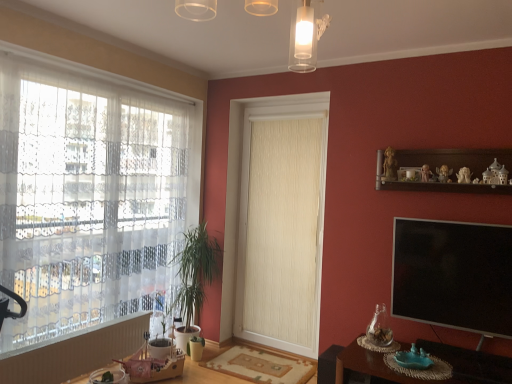
Question: From the image's perspective, is white textured radiator at lower left on top of green leafy plant at left?

Choices:
 (A) no
 (B) yes

Answer: (A)

Question: Does white textured radiator at lower left have a smaller size compared to green leafy plant at left?

Choices:
 (A) no
 (B) yes

Answer: (B)

Question: Is white textured radiator at lower left to the left of green leafy plant at left from the viewer's perspective?

Choices:
 (A) yes
 (B) no

Answer: (A)

Question: Is white textured radiator at lower left positioned in front of green leafy plant at left?

Choices:
 (A) no
 (B) yes

Answer: (B)

Question: Is white textured radiator at lower left further to camera compared to green leafy plant at left?

Choices:
 (A) yes
 (B) no

Answer: (B)

Question: Is the surface of white textured radiator at lower left in direct contact with green leafy plant at left?

Choices:
 (A) yes
 (B) no

Answer: (B)

Question: Can you confirm if translucent glass light fixture at upper center is smaller than beige textured curtain at center?

Choices:
 (A) no
 (B) yes

Answer: (B)

Question: Is translucent glass light fixture at upper center at the left side of beige textured curtain at center?

Choices:
 (A) no
 (B) yes

Answer: (B)

Question: Does translucent glass light fixture at upper center lie in front of beige textured curtain at center?

Choices:
 (A) yes
 (B) no

Answer: (A)

Question: Does translucent glass light fixture at upper center have a lesser width compared to beige textured curtain at center?

Choices:
 (A) no
 (B) yes

Answer: (A)

Question: Is translucent glass light fixture at upper center outside of beige textured curtain at center?

Choices:
 (A) yes
 (B) no

Answer: (A)

Question: From the image's perspective, is translucent glass light fixture at upper center under beige textured curtain at center?

Choices:
 (A) yes
 (B) no

Answer: (B)

Question: From a real-world perspective, is white lace curtain at left located beneath wooden round table at lower left?

Choices:
 (A) no
 (B) yes

Answer: (A)